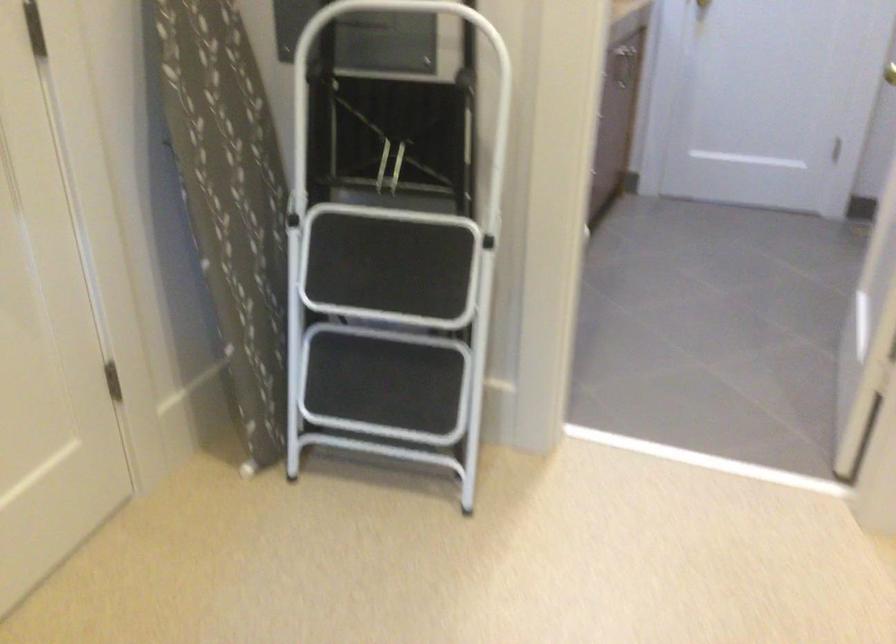
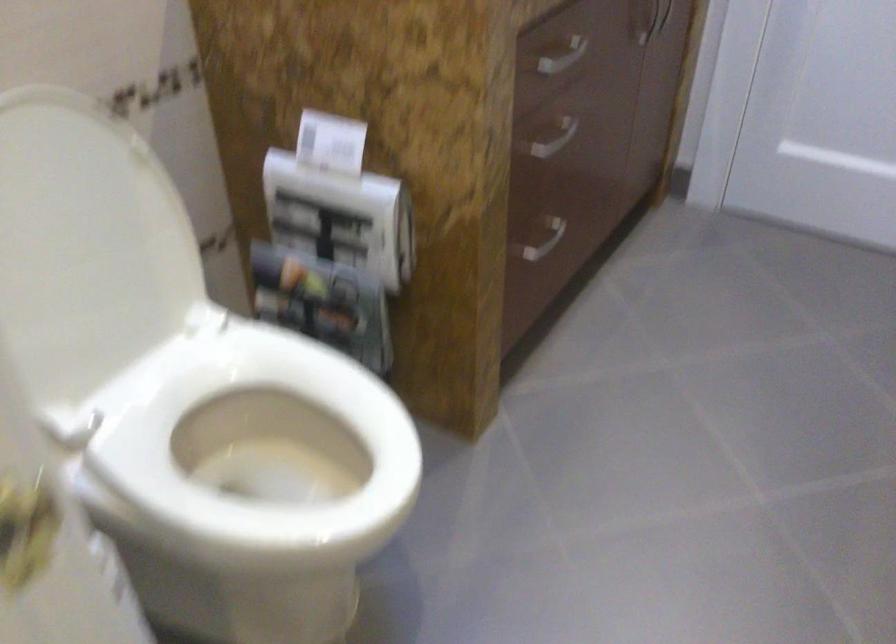
Which direction would the cameraman need to move to produce the second image?

The cameraman moved toward right, forward.